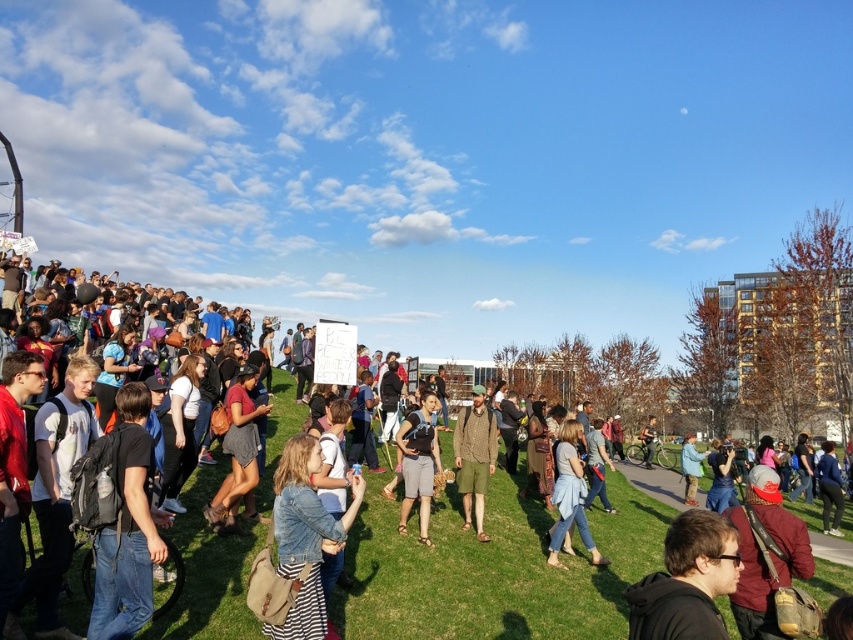
Question: Which point appears farthest from the camera in this image?

Choices:
 (A) (476, 435)
 (B) (293, 454)
 (C) (422, 544)
 (D) (561, 440)

Answer: (A)

Question: Can you confirm if camouflage-patterned shorts at center is positioned to the right of matte black backpack at center?

Choices:
 (A) yes
 (B) no

Answer: (A)

Question: Can you confirm if camouflage-patterned shorts at center is smaller than denim jacket at lower center?

Choices:
 (A) no
 (B) yes

Answer: (A)

Question: Considering the real-world distances, which object is closest to the camouflage-patterned shorts at center?

Choices:
 (A) denim jacket at lower center
 (B) matte black backpack at center

Answer: (B)

Question: Can you confirm if matte black backpack at center is smaller than denim jacket at lower center?

Choices:
 (A) no
 (B) yes

Answer: (B)

Question: Among these objects, which one is nearest to the camera?

Choices:
 (A) denim jacket at center
 (B) matte black backpack at center
 (C) camouflage-patterned shorts at center

Answer: (A)